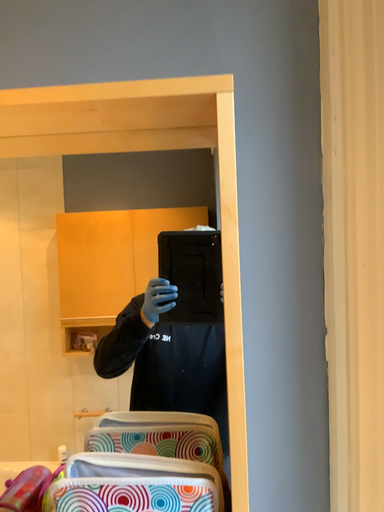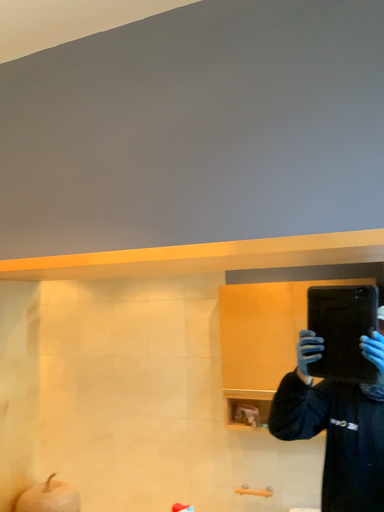
Question: How did the camera likely rotate when shooting the video?

Choices:
 (A) rotated downward
 (B) rotated upward

Answer: (B)